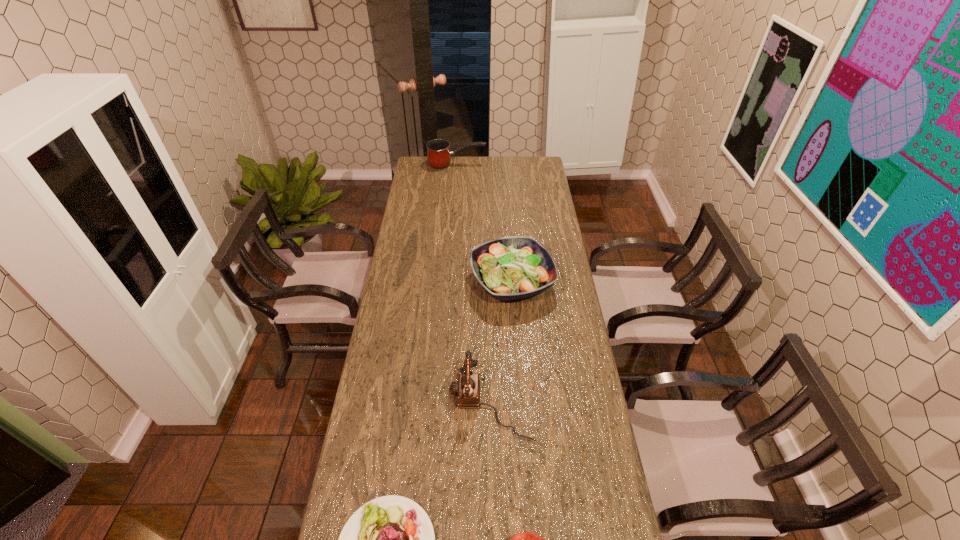
Locate an element on the screen. The image size is (960, 540). object that is the fourth closest to the farthest object is located at coordinates (522, 539).

This screenshot has height=540, width=960. I want to click on vacant area that satisfies the following two spatial constraints: 1. on the handle side of the second farthest object; 2. on the left side of the saucepan, so click(x=448, y=282).

I want to click on vacant space that satisfies the following two spatial constraints: 1. on the handle side of the farther salad plate; 2. on the right side of the saucepan, so click(x=448, y=282).

Where is `free region that satisfies the following two spatial constraints: 1. on the handle side of the farthest object; 2. on the right side of the right salad plate`? This screenshot has height=540, width=960. free region that satisfies the following two spatial constraints: 1. on the handle side of the farthest object; 2. on the right side of the right salad plate is located at coordinates (448, 282).